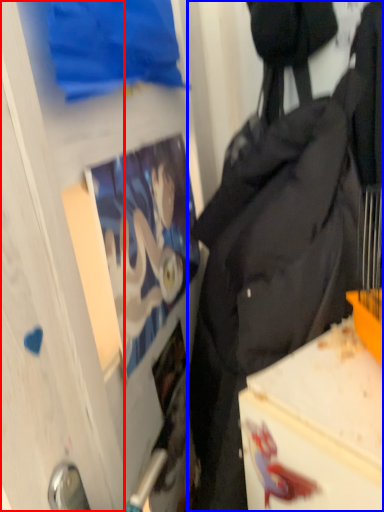
Question: Which object appears farthest to the camera in this image, glass door (highlighted by a red box) or backpack (highlighted by a blue box)?

Choices:
 (A) glass door
 (B) backpack

Answer: (B)